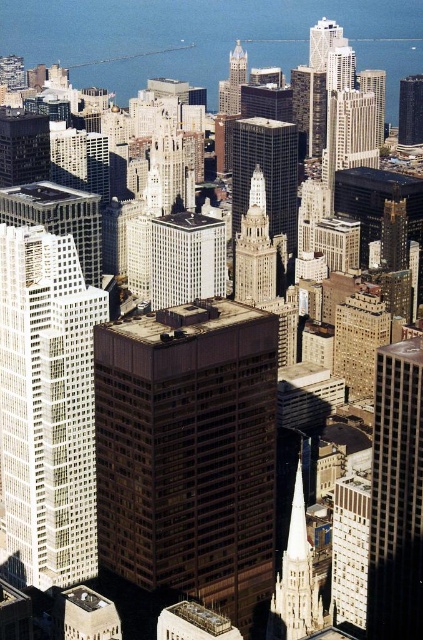
Question: Is white glass building at left bigger than brown glass skyscraper at upper right?

Choices:
 (A) yes
 (B) no

Answer: (A)

Question: Can you confirm if brown glassy building at center is wider than gold glass skyscraper at center?

Choices:
 (A) no
 (B) yes

Answer: (B)

Question: Among these objects, which one is nearest to the camera?

Choices:
 (A) brown glassy building at center
 (B) light brown stone spire at center
 (C) gold glass skyscraper at center

Answer: (A)

Question: Which of these objects is positioned closest to the brown glass skyscraper at upper right?

Choices:
 (A) light brown stone spire at center
 (B) brown glassy building at center
 (C) white glass building at left

Answer: (B)

Question: Which of the following is the farthest from the observer?

Choices:
 (A) (274, 138)
 (B) (76, 531)

Answer: (B)

Question: Can you confirm if brown glassy building at center is thinner than brown glassy building at right?

Choices:
 (A) yes
 (B) no

Answer: (B)